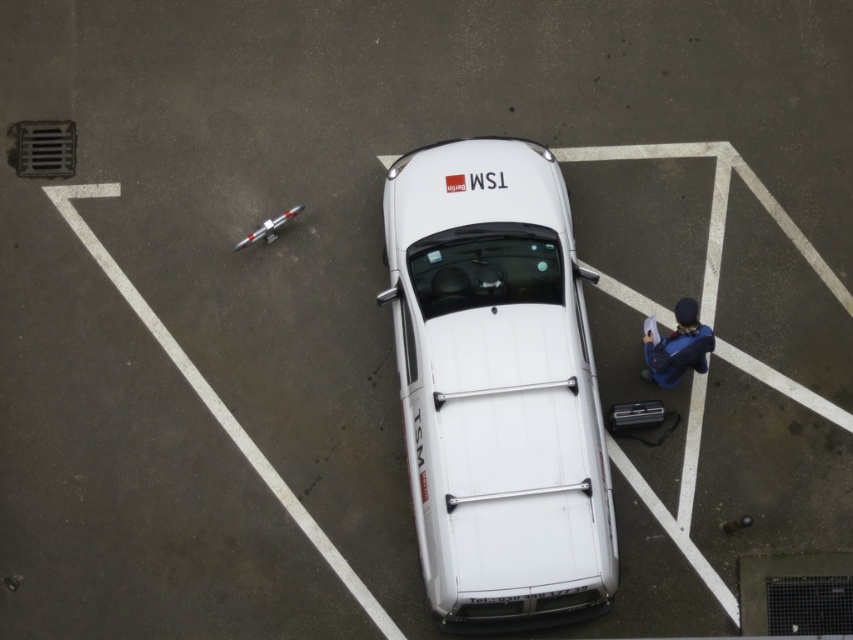
Between white matte van at center and blue fabric jacket at lower right, which one has less height?

With less height is blue fabric jacket at lower right.

Can you confirm if white matte van at center is wider than blue fabric jacket at lower right?

Yes.

Based on the photo, who is more forward, (561,529) or (654,348)?

Point (561,529) is in front.

I want to click on white matte van at center, so click(x=497, y=387).